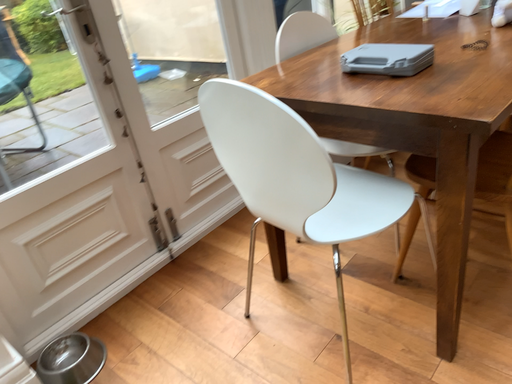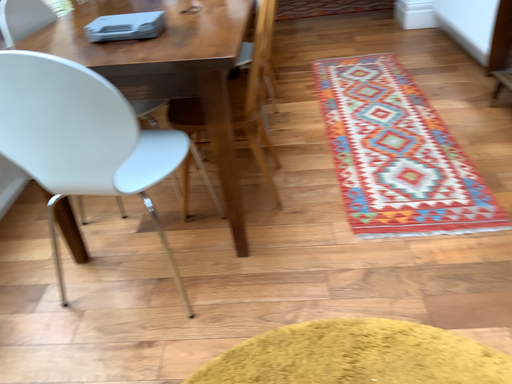
Question: How did the camera likely rotate when shooting the video?

Choices:
 (A) rotated right
 (B) rotated left

Answer: (A)